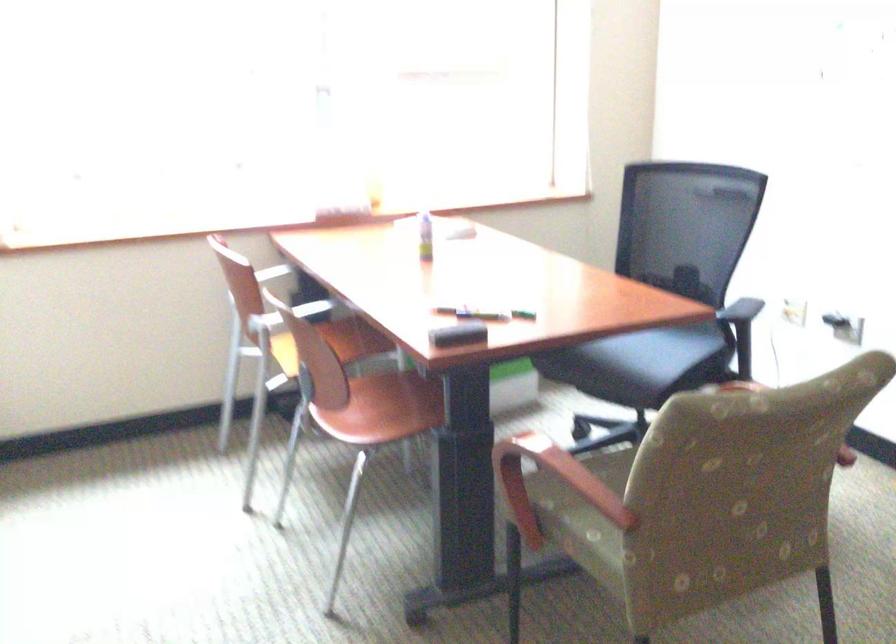
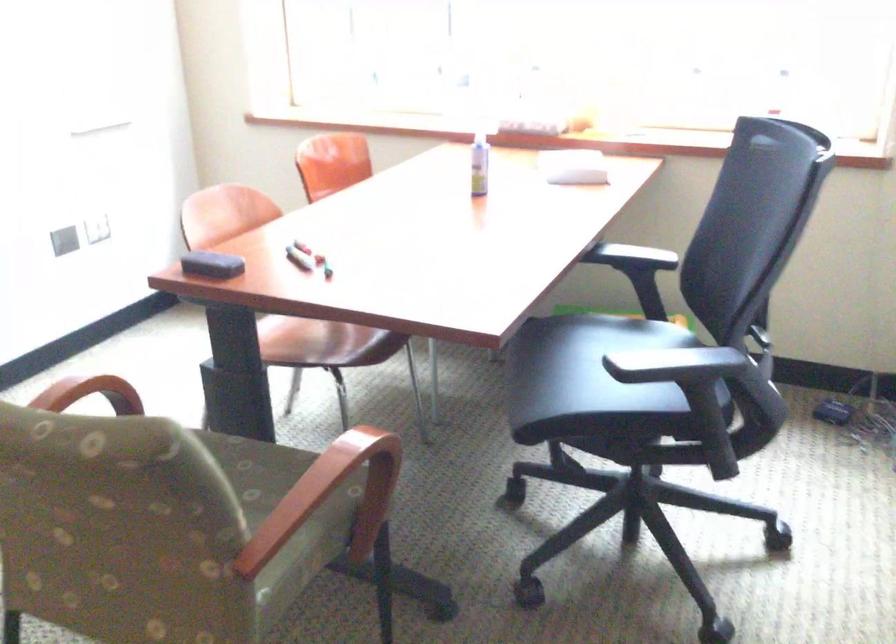
Find the pixel in the second image that matches pixel 626 342 in the first image.

(591, 361)